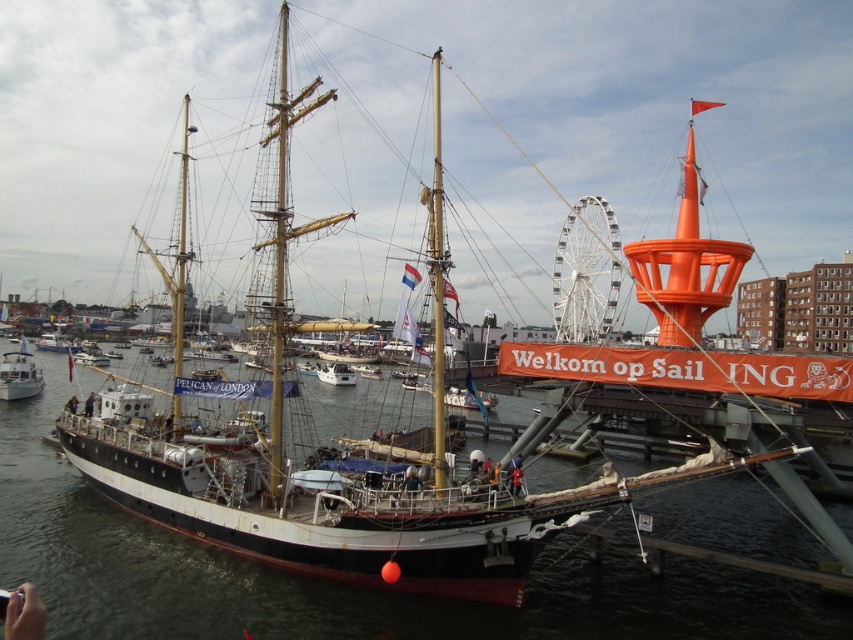
Question: Is wooden mast at center positioned in front of white matte boat at center?

Choices:
 (A) yes
 (B) no

Answer: (A)

Question: Can you confirm if black water at center is positioned below white glossy boat at center?

Choices:
 (A) no
 (B) yes

Answer: (B)

Question: Which point is closer to the camera?

Choices:
 (A) wooden mast at center
 (B) white glossy boat at center
 (C) white matte boat at center

Answer: (A)

Question: Considering the real-world distances, which object is farthest from the black water at center?

Choices:
 (A) white glossy boat at center
 (B) wooden mast at center

Answer: (A)

Question: Which point is farther to the camera?

Choices:
 (A) (26, 349)
 (B) (341, 365)

Answer: (A)

Question: Observing the image, what is the correct spatial positioning of black water at center in reference to wooden mast at center?

Choices:
 (A) below
 (B) above

Answer: (A)